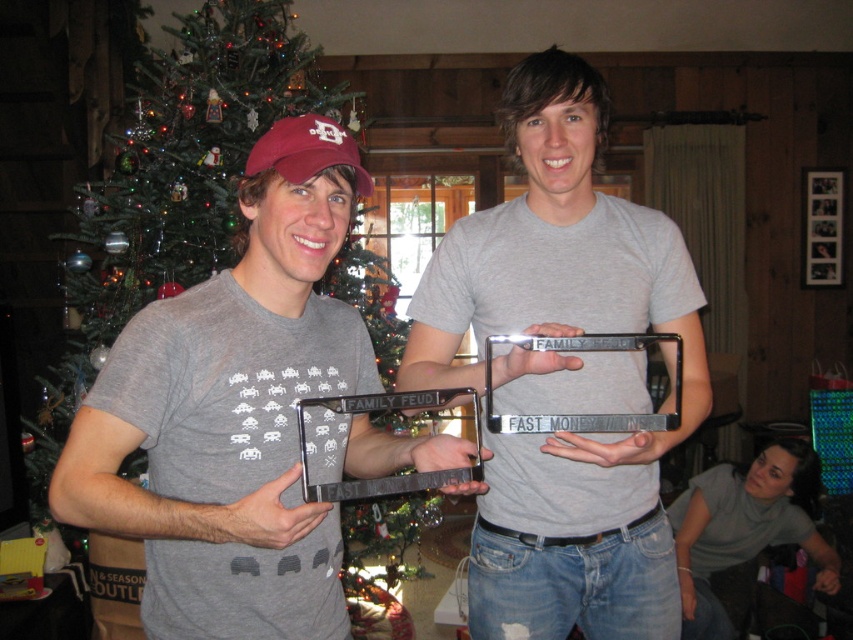
Looking at this image, does green matte christmas tree at upper left appear over gray cotton shirt at lower right?

Correct, green matte christmas tree at upper left is located above gray cotton shirt at lower right.

Consider the image. Is green matte christmas tree at upper left further to camera compared to gray cotton shirt at lower right?

No, green matte christmas tree at upper left is closer to the viewer.

Between point (247, 26) and point (767, 538), which one is positioned behind?

The point (767, 538) is more distant.

The height and width of the screenshot is (640, 853). I want to click on green matte christmas tree at upper left, so click(x=177, y=182).

Is matte gray t-shirt at center in front of green matte christmas tree at upper left?

That is True.

Who is more forward, (526,387) or (383,308)?

Point (526,387)

This screenshot has width=853, height=640. Identify the location of matte gray t-shirt at center. (561, 333).

From the picture: Can you confirm if matte gray t-shirt at center is positioned to the right of gray cotton shirt at lower right?

No, matte gray t-shirt at center is not to the right of gray cotton shirt at lower right.

Is matte gray t-shirt at center positioned before gray cotton shirt at lower right?

That is True.

Describe the element at coordinates (561, 333) in the screenshot. This screenshot has height=640, width=853. I see `matte gray t-shirt at center` at that location.

This screenshot has height=640, width=853. Identify the location of matte gray t-shirt at center. (561, 333).